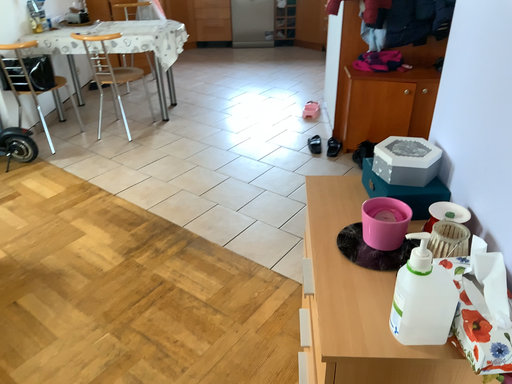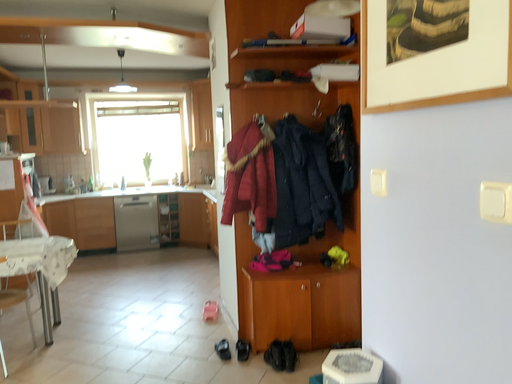
Question: How did the camera likely rotate when shooting the video?

Choices:
 (A) rotated upward
 (B) rotated downward

Answer: (A)